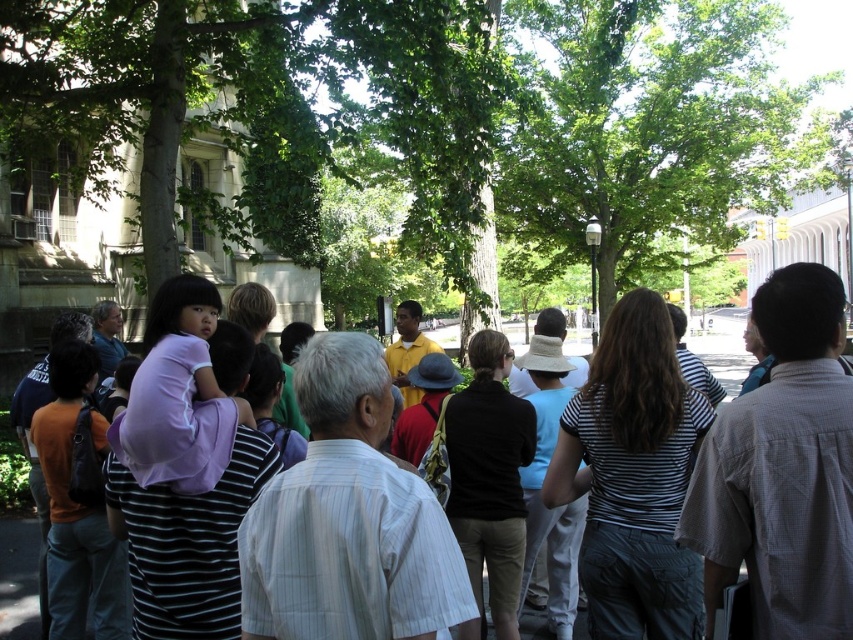
You are a photographer trying to capture a wide shot of the purple fabric at center and the green leafy tree at left. If your camera has a maximum focus range of 60 feet, will you be able to include both subjects in the same frame without moving closer?

The distance between the green leafy tree at left and the purple fabric at center is 58.21 feet, which is within the camera maximum focus range of 60 feet. Therefore, you can include both subjects in the same frame without moving closer.

You are part of a tour group in a park with a green leafy tree at left and a purple fabric at center. The tour guide asks you to estimate which object takes up more visual space in the scene. Based on the description, which one would you choose?

The purple fabric at center occupies more visual space than the green leafy tree at left according to the description.